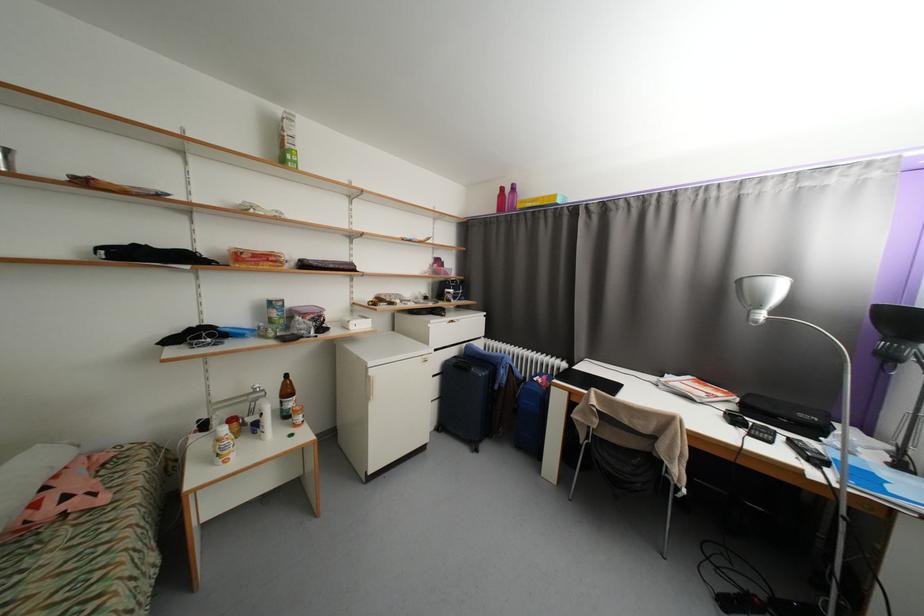
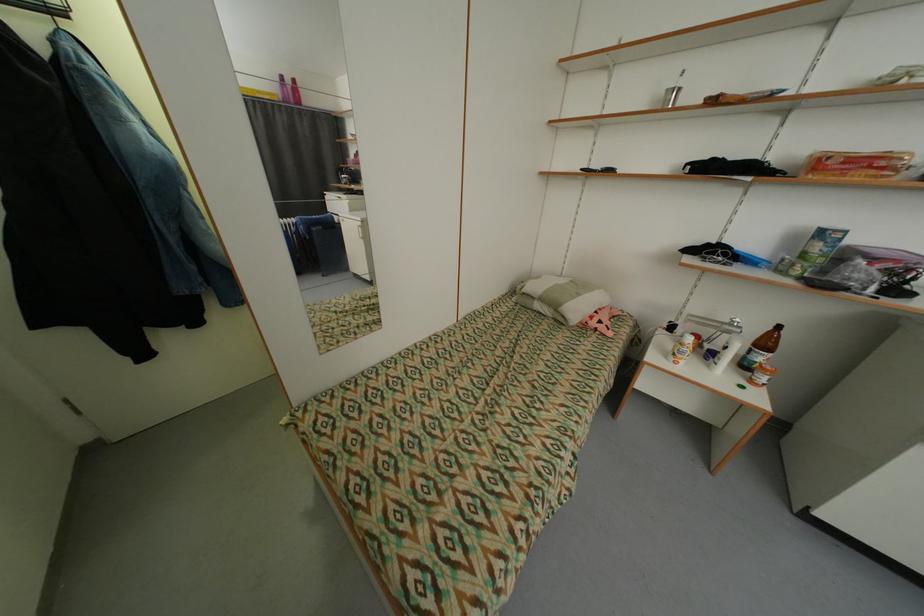
Where in the second image is the point corresponding to (54,513) from the first image?

(600, 323)